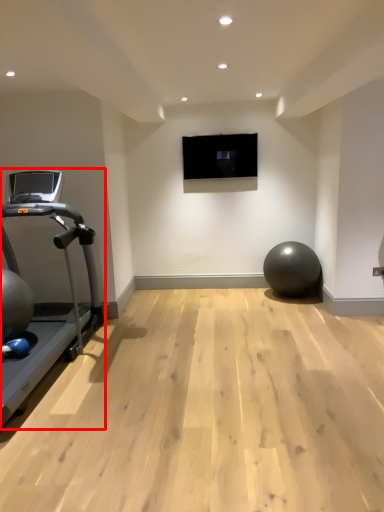
Question: Observing the image, what is the correct spatial positioning of treadmill (annotated by the red box) in reference to ball?

Choices:
 (A) left
 (B) right

Answer: (A)